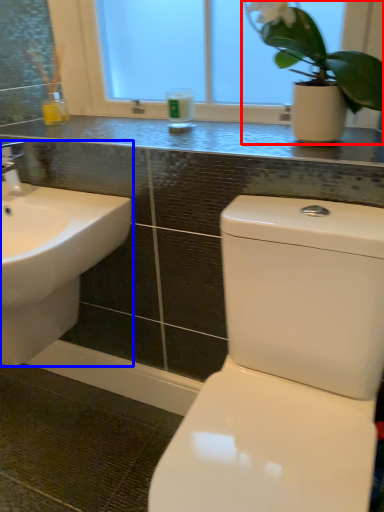
Question: Which object is closer to the camera taking this photo, houseplant (highlighted by a red box) or sink (highlighted by a blue box)?

Choices:
 (A) houseplant
 (B) sink

Answer: (A)